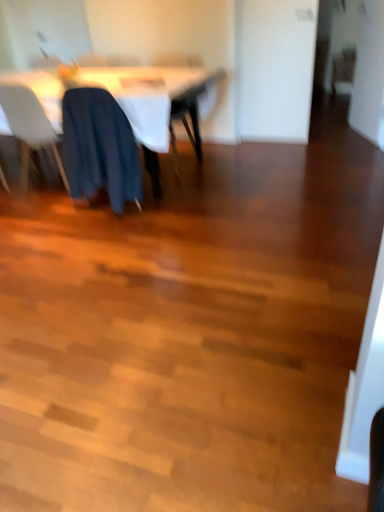
Question: Can you confirm if white plastic chair at left, placed as the 4th chair when sorted from right to left, is thinner than white fabric table at upper left?

Choices:
 (A) yes
 (B) no

Answer: (A)

Question: Considering the relative sizes of white plastic chair at left, placed as the 4th chair when sorted from right to left, and white fabric table at upper left in the image provided, is white plastic chair at left, placed as the 4th chair when sorted from right to left, smaller than white fabric table at upper left?

Choices:
 (A) no
 (B) yes

Answer: (B)

Question: Is white plastic chair at left, which is counted as the 2th chair, starting from the front, at the right side of white fabric table at upper left?

Choices:
 (A) no
 (B) yes

Answer: (A)

Question: Considering the relative sizes of white plastic chair at left, placed as the 4th chair when sorted from right to left, and white fabric table at upper left in the image provided, is white plastic chair at left, placed as the 4th chair when sorted from right to left, wider than white fabric table at upper left?

Choices:
 (A) yes
 (B) no

Answer: (B)

Question: Is white plastic chair at left, positioned as the third chair in back-to-front order, to the left of white fabric table at upper left from the viewer's perspective?

Choices:
 (A) yes
 (B) no

Answer: (A)

Question: From the image's perspective, does white plastic chair at left, marked as the first chair in a left-to-right arrangement, appear higher than white fabric table at upper left?

Choices:
 (A) yes
 (B) no

Answer: (B)

Question: Is white fabric table at upper left to the right of wooden chair at upper right, which ranks as the fourth chair in left-to-right order, from the viewer's perspective?

Choices:
 (A) yes
 (B) no

Answer: (B)

Question: Is the depth of white fabric table at upper left less than that of wooden chair at upper right, which ranks as the fourth chair in left-to-right order?

Choices:
 (A) yes
 (B) no

Answer: (A)

Question: Does white fabric table at upper left turn towards wooden chair at upper right, which ranks as the 1th chair in right-to-left order?

Choices:
 (A) yes
 (B) no

Answer: (B)

Question: Does white fabric table at upper left lie behind wooden chair at upper right, which ranks as the 1th chair in right-to-left order?

Choices:
 (A) yes
 (B) no

Answer: (B)

Question: From a real-world perspective, is white fabric table at upper left below wooden chair at upper right, which ranks as the fourth chair in left-to-right order?

Choices:
 (A) no
 (B) yes

Answer: (A)

Question: Does white fabric table at upper left have a greater width compared to wooden chair at upper right, which ranks as the 1th chair in right-to-left order?

Choices:
 (A) yes
 (B) no

Answer: (A)

Question: Does dark blue fabric at center, acting as the second chair starting from the left, appear on the right side of white plastic chair at left, marked as the first chair in a left-to-right arrangement?

Choices:
 (A) yes
 (B) no

Answer: (A)